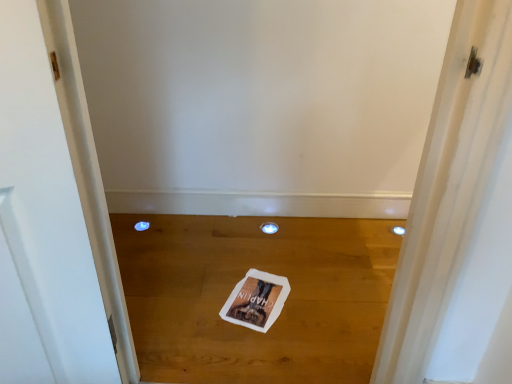
This screenshot has height=384, width=512. Find the location of `free space to the left of white paper magazine at center`. free space to the left of white paper magazine at center is located at coordinates (197, 294).